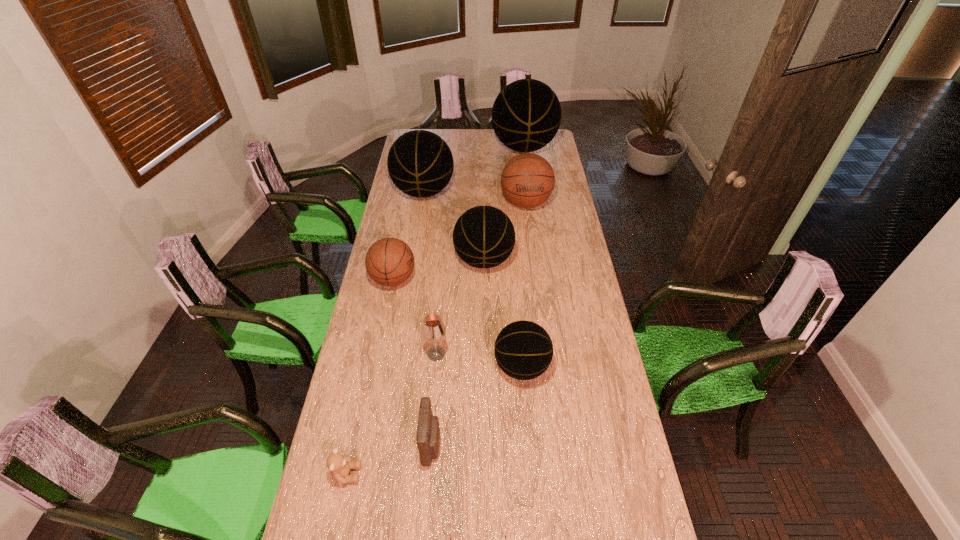
Point out which basketball is positioned as the fifth nearest to the shortest object. Please provide its 2D coordinates. Your answer should be formatted as a tuple, i.e. [(x, y)], where the tuple contains the x and y coordinates of a point satisfying the conditions above.

[(420, 163)]

Identify which black basketball is the third closest to the wineglass. Please provide its 2D coordinates. Your answer should be formatted as a tuple, i.e. [(x, y)], where the tuple contains the x and y coordinates of a point satisfying the conditions above.

[(420, 163)]

I want to click on black basketball that can be found as the second closest to the leftmost black basketball, so click(x=484, y=237).

Where is `vacant position in the image that satisfies the following two spatial constraints: 1. on the front side of the leftmost black basketball; 2. on the left side of the second smallest black basketball`? This screenshot has width=960, height=540. vacant position in the image that satisfies the following two spatial constraints: 1. on the front side of the leftmost black basketball; 2. on the left side of the second smallest black basketball is located at coordinates (413, 260).

Where is `free space that satisfies the following two spatial constraints: 1. on the side with brand label of the bigger brown basketball; 2. with an open flap on the pouch`? Image resolution: width=960 pixels, height=540 pixels. free space that satisfies the following two spatial constraints: 1. on the side with brand label of the bigger brown basketball; 2. with an open flap on the pouch is located at coordinates (556, 445).

Find the location of a particular element. This screenshot has width=960, height=540. free spot that satisfies the following two spatial constraints: 1. on the side with brand label of the bigger brown basketball; 2. on the front-facing side of the second shortest object is located at coordinates (560, 474).